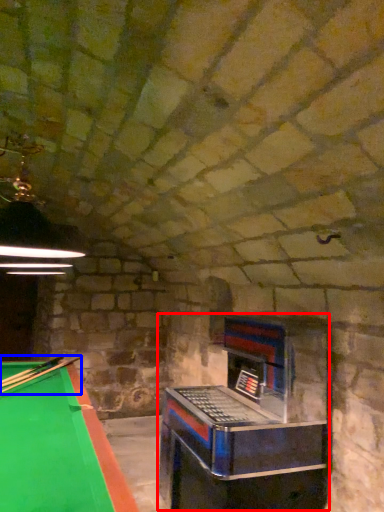
Question: Which object appears closest to the camera in this image, slot machine (highlighted by a red box) or cue (highlighted by a blue box)?

Choices:
 (A) slot machine
 (B) cue

Answer: (A)